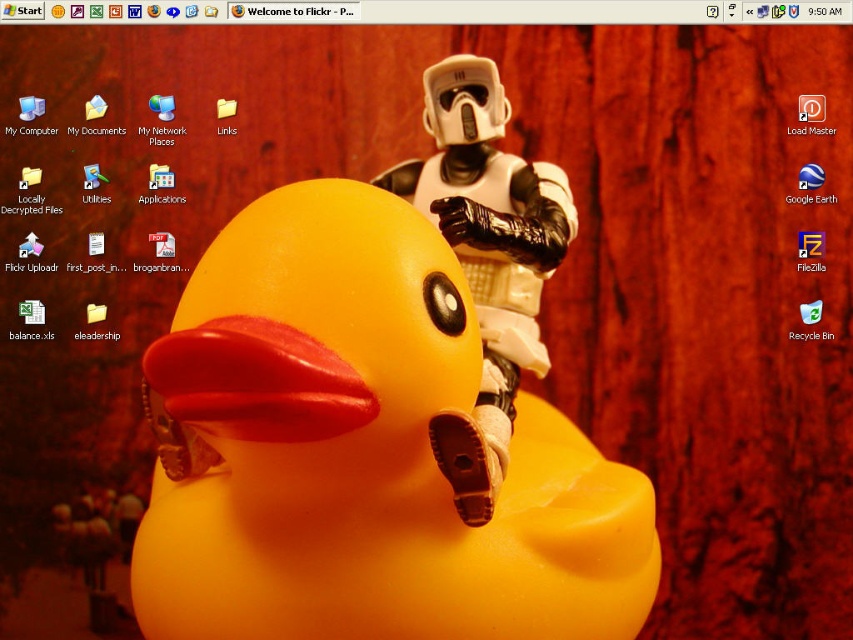
You are looking at the computer desktop background. There are two points marked on the screen, point 1 at coordinates point (399,214) and point 2 at coordinates point (415,172). Which point is closer to you?

Point (399,214) is closer to the viewer than point (415,172).

You are organizing your computer desktop and want to move an icon from the rubber yellow duck at center to the white matte stormtrooper helmet at center. Based on their positions, which object should you move the icon towards on the right side?

The rubber yellow duck at center is to the left of the white matte stormtrooper helmet at center, so you should move the icon towards the white matte stormtrooper helmet at center which is on the right side.